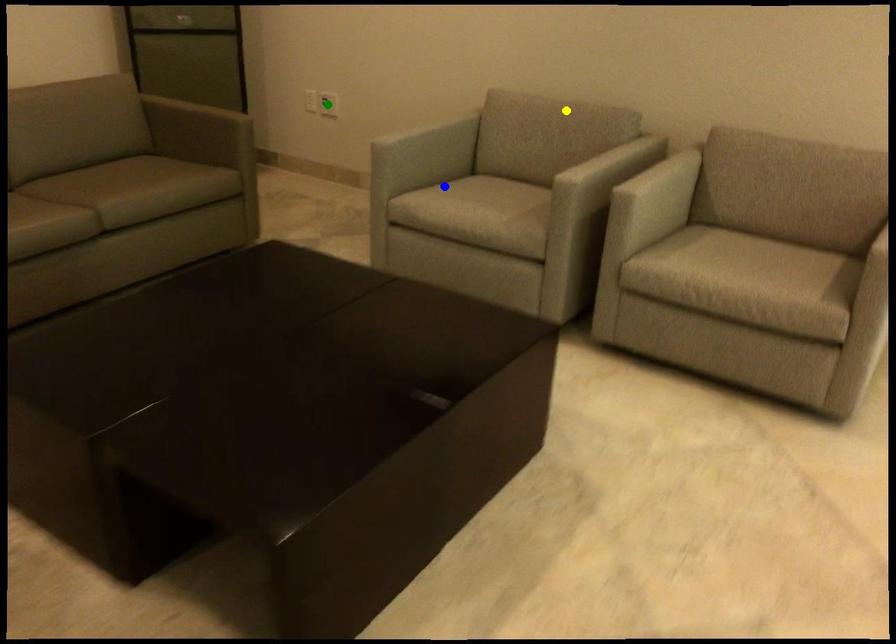
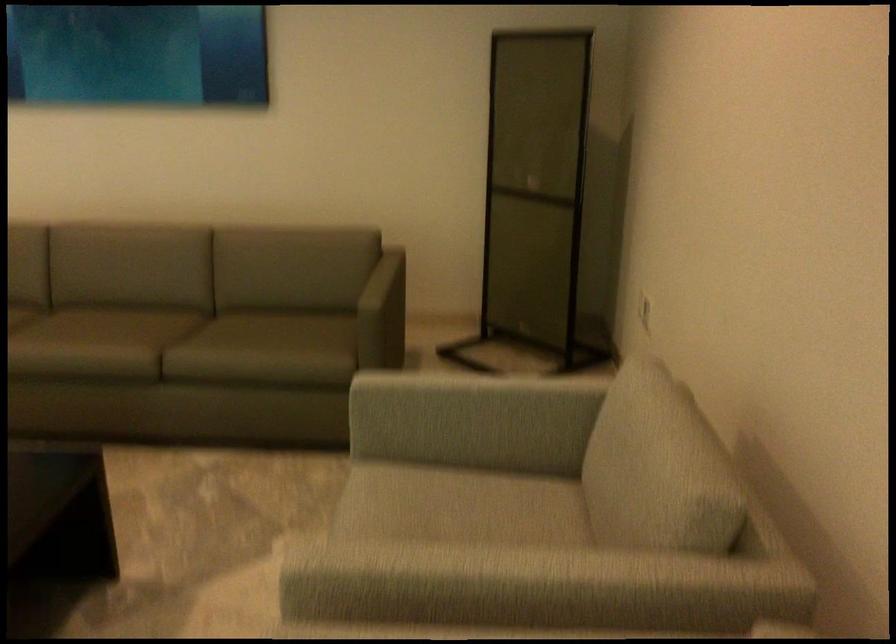
I am providing you with two images of the same scene from different viewpoints. Three points are marked in image1. Which point corresponds to a part or object that is occluded in image2?In image1, three points are marked. Which of them correspond to a part or object that is occluded in image2?Among the three points shown in image1, which one corresponds to a part or object that is no longer visible due to occlusion in image2?

green point cannot be seen in image2.